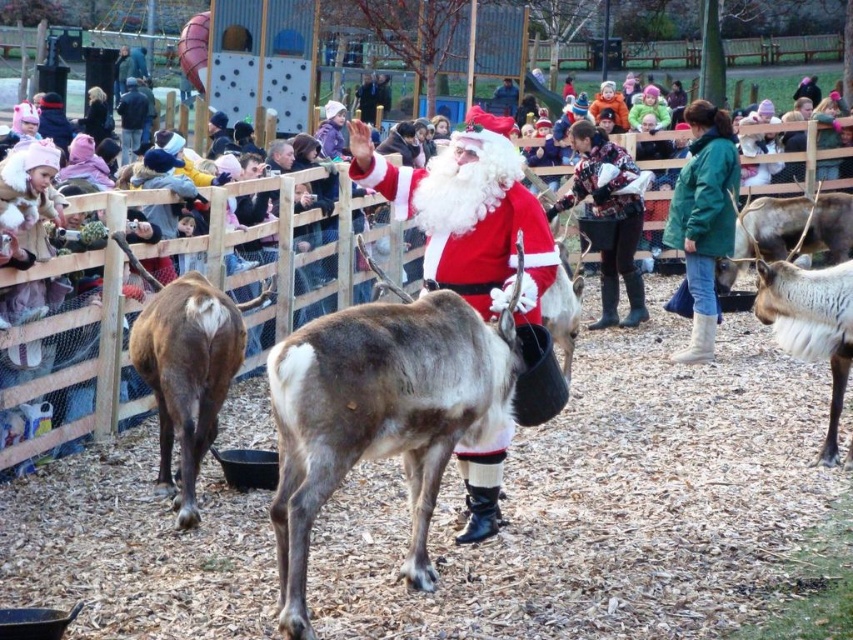
You are standing in the festive outdoor scene and see the green suede boots at lower right and the dark brown leather boots at center. Which pair of boots is more to the right?

The green suede boots at lower right is positioned on the right side of dark brown leather boots at center, so the green suede boots at lower right is more to the right.

You are standing at point [625,168] and want to walk to Santa Claus who is at point [149,332]. Is there a clear path between these two points without obstacles?

Yes, there is a clear path between point [625,168] and point 0.527, 0.177 since the first point is in front of the second one, indicating no obstruction between them.